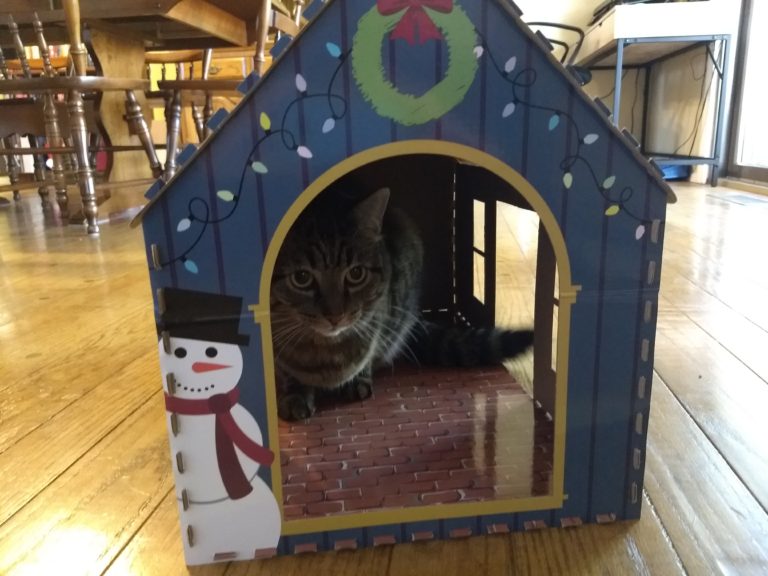
Locate an element on the screen. This screenshot has height=576, width=768. wood floor is located at coordinates (64, 480).